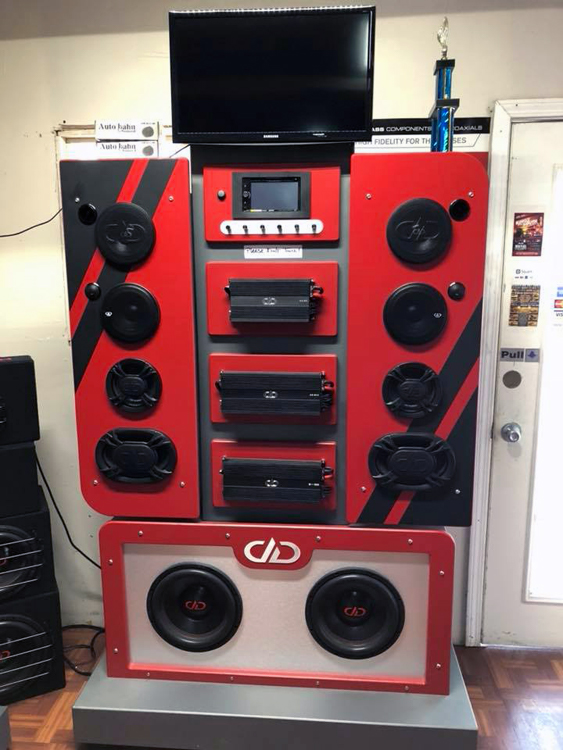
Where is `trophy`? The height and width of the screenshot is (750, 563). trophy is located at coordinates (443, 115).